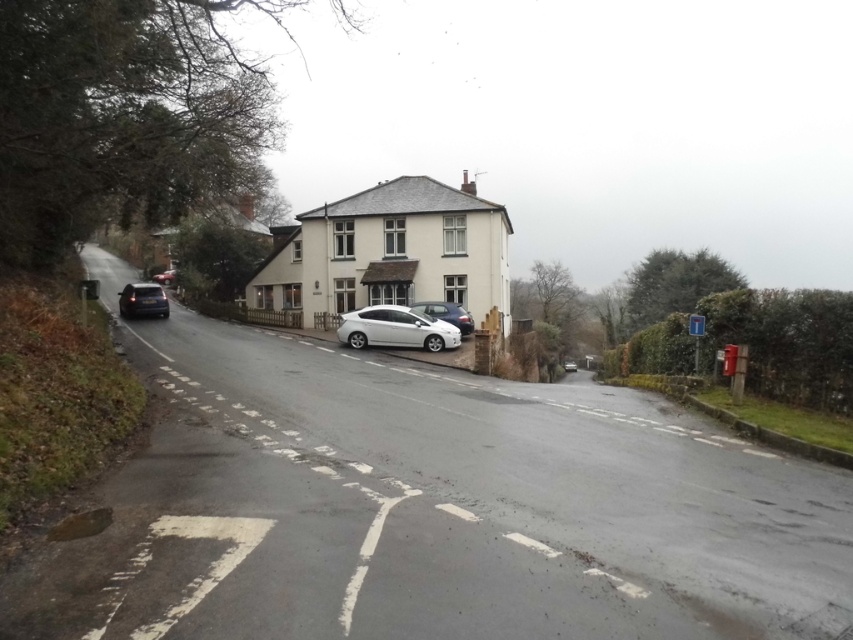
Question: Considering the relative positions of satin white sedan at center and shiny dark blue sedan at left in the image provided, where is satin white sedan at center located with respect to shiny dark blue sedan at left?

Choices:
 (A) below
 (B) above

Answer: (A)

Question: Can you confirm if satin white sedan at center is positioned to the right of shiny dark blue sedan at left?

Choices:
 (A) no
 (B) yes

Answer: (B)

Question: Among these objects, which one is nearest to the camera?

Choices:
 (A) shiny dark blue sedan at left
 (B) satin silver sedan at center
 (C) satin white sedan at center

Answer: (C)

Question: Which of the following is the farthest from the observer?

Choices:
 (A) satin silver sedan at center
 (B) shiny dark blue sedan at left

Answer: (B)

Question: Estimate the real-world distances between objects in this image. Which object is farther from the shiny dark blue sedan at left?

Choices:
 (A) satin silver sedan at center
 (B) satin white sedan at center

Answer: (A)

Question: Does shiny dark blue sedan at left have a lesser width compared to satin silver sedan at center?

Choices:
 (A) yes
 (B) no

Answer: (B)